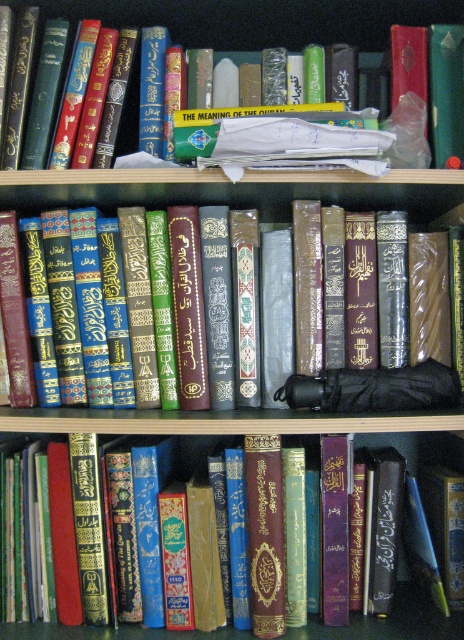
Based on the photo, can you confirm if green leather book at upper center is bigger than green leather book at center?

Indeed, green leather book at upper center has a larger size compared to green leather book at center.

Find the location of a particular element. This screenshot has width=464, height=640. green leather book at upper center is located at coordinates (257, 19).

What are the coordinates of `green leather book at upper center` in the screenshot? It's located at (257, 19).

Can you confirm if green leather book at center is positioned below gold embossed book at center?

Yes.

Looking at this image, which is more to the right, green leather book at center or gold embossed book at center?

From the viewer's perspective, gold embossed book at center appears more on the right side.

Does point (334, 632) lie behind point (290, 248)?

That is False.

Identify the location of green leather book at center. coord(390,621).

Can you confirm if green leather book at upper center is bigger than gold embossed book at center?

No, green leather book at upper center is not bigger than gold embossed book at center.

Image resolution: width=464 pixels, height=640 pixels. Describe the element at coordinates (257, 19) in the screenshot. I see `green leather book at upper center` at that location.

Image resolution: width=464 pixels, height=640 pixels. I want to click on green leather book at upper center, so click(x=257, y=19).